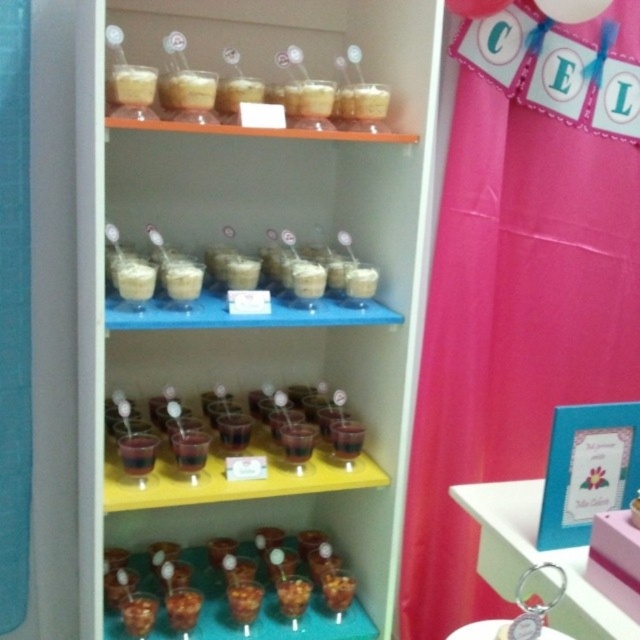
Question: Which object appears farthest from the camera in this image?

Choices:
 (A) pink glossy keychain at lower right
 (B) translucent glass cups at center

Answer: (B)

Question: Can you confirm if translucent glass cups at center is thinner than pink glossy keychain at lower right?

Choices:
 (A) yes
 (B) no

Answer: (B)

Question: Does translucent glass cups at center have a lesser width compared to pink glossy keychain at lower right?

Choices:
 (A) no
 (B) yes

Answer: (A)

Question: Is translucent glass cups at center wider than pink glossy keychain at lower right?

Choices:
 (A) no
 (B) yes

Answer: (B)